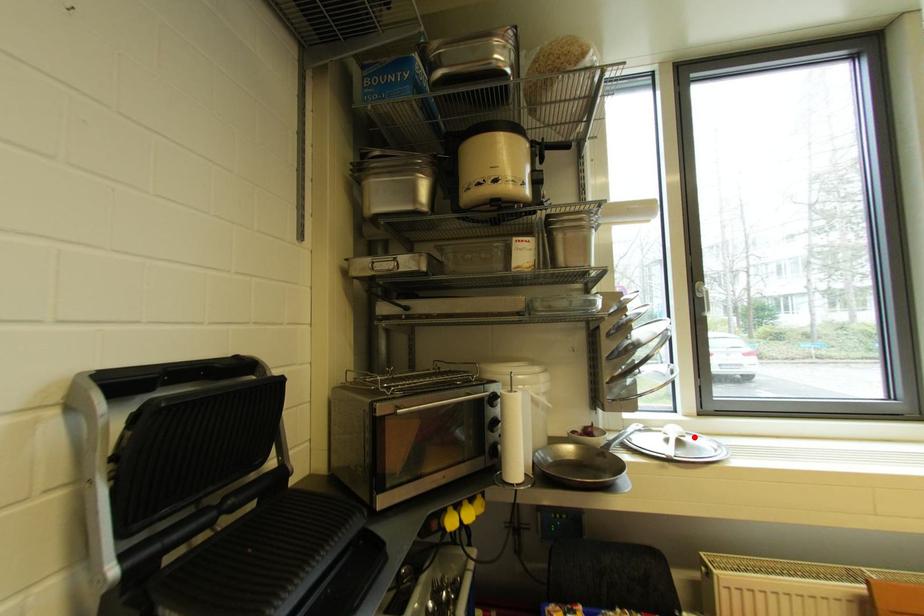
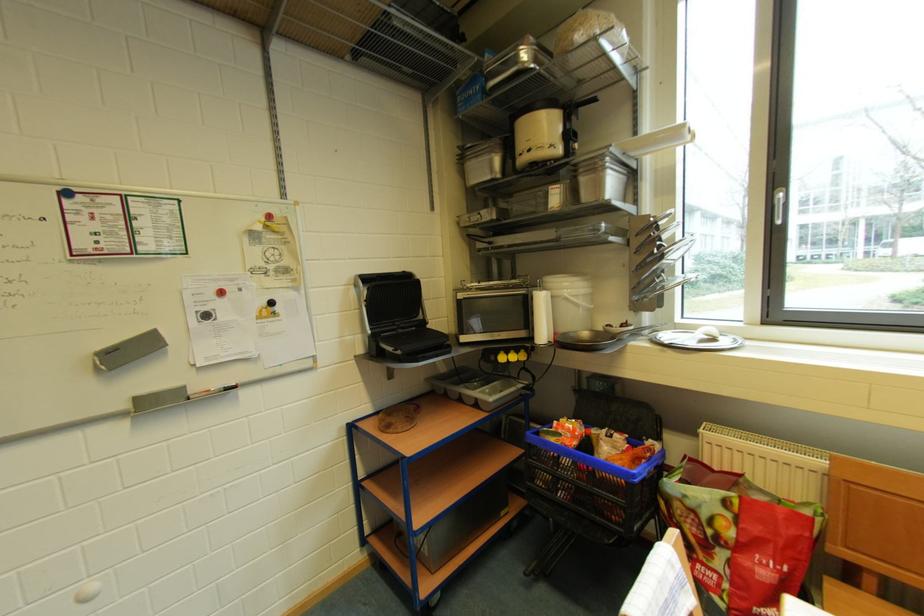
In the second image, find the point that corresponds to the highlighted location in the first image.

(730, 339)